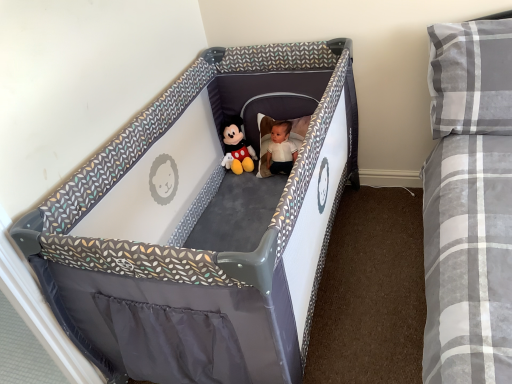
Where is `gray fabric playpen at center`? This screenshot has height=384, width=512. gray fabric playpen at center is located at coordinates (x=200, y=225).

Identify the location of gray plaid pillow at upper right. (471, 78).

The image size is (512, 384). I want to click on soft plush mickey mouse at center, so click(x=234, y=142).

The width and height of the screenshot is (512, 384). What do you see at coordinates (234, 142) in the screenshot?
I see `soft plush mickey mouse at center` at bounding box center [234, 142].

What are the coordinates of `gray fabric playpen at center` in the screenshot? It's located at (200, 225).

In the scene shown: In the image, is gray plaid pillow at upper right positioned in front of or behind gray fabric playpen at center?

gray plaid pillow at upper right is behind gray fabric playpen at center.

From the image's perspective, is gray plaid pillow at upper right positioned above or below gray fabric playpen at center?

From the image's perspective, gray plaid pillow at upper right appears above gray fabric playpen at center.

Is gray plaid pillow at upper right thinner than gray fabric playpen at center?

Correct, the width of gray plaid pillow at upper right is less than that of gray fabric playpen at center.

Would you consider gray plaid pillow at upper right to be distant from gray fabric playpen at center?

No, there isn't a large distance between gray plaid pillow at upper right and gray fabric playpen at center.

Based on the photo, from the image's perspective, between gray fabric playpen at center and soft plush mickey mouse at center, who is located below?

gray fabric playpen at center is shown below in the image.

From a real-world perspective, is gray fabric playpen at center positioned above or below soft plush mickey mouse at center?

In terms of real-world spatial position, gray fabric playpen at center is below soft plush mickey mouse at center.

Is gray fabric playpen at center in front of gray plaid pillow at upper right?

Yes, it is.

Between gray fabric playpen at center and gray plaid pillow at upper right, which one appears on the left side from the viewer's perspective?

gray fabric playpen at center.

Which of these two, gray fabric playpen at center or gray plaid pillow at upper right, is wider?

gray fabric playpen at center is wider.

In terms of size, does gray plaid pillow at upper right appear bigger or smaller than soft plush mickey mouse at center?

Clearly, gray plaid pillow at upper right is larger in size than soft plush mickey mouse at center.

Is gray plaid pillow at upper right in contact with soft plush mickey mouse at center?

No, gray plaid pillow at upper right is not beside soft plush mickey mouse at center.

Is soft plush mickey mouse at center completely or partially inside gray plaid pillow at upper right?

That's incorrect, soft plush mickey mouse at center is not inside gray plaid pillow at upper right.

Considering the relative positions of gray plaid pillow at upper right and soft plush mickey mouse at center in the image provided, is gray plaid pillow at upper right to the right of soft plush mickey mouse at center from the viewer's perspective?

Indeed, gray plaid pillow at upper right is positioned on the right side of soft plush mickey mouse at center.

Is soft plush mickey mouse at center facing towards gray plaid pillow at upper right?

No, soft plush mickey mouse at center is not aimed at gray plaid pillow at upper right.

Is soft plush mickey mouse at center next to gray plaid pillow at upper right?

There is a gap between soft plush mickey mouse at center and gray plaid pillow at upper right.

Does soft plush mickey mouse at center have a larger size compared to gray plaid pillow at upper right?

No, soft plush mickey mouse at center is not bigger than gray plaid pillow at upper right.

Which object is thinner, soft plush mickey mouse at center or gray plaid pillow at upper right?

soft plush mickey mouse at center is thinner.

Looking at their sizes, would you say soft plush mickey mouse at center is wider or thinner than gray fabric playpen at center?

Clearly, soft plush mickey mouse at center has less width compared to gray fabric playpen at center.

Is soft plush mickey mouse at center next to gray fabric playpen at center?

No, soft plush mickey mouse at center is not in contact with gray fabric playpen at center.

Considering the positions of objects soft plush mickey mouse at center and gray fabric playpen at center in the image provided, who is more to the left, soft plush mickey mouse at center or gray fabric playpen at center?

From the viewer's perspective, soft plush mickey mouse at center appears more on the left side.

The image size is (512, 384). I want to click on infant bed in front of the gray plaid pillow at upper right, so click(x=200, y=225).

This screenshot has height=384, width=512. In the image, there is a soft plush mickey mouse at center. What are the coordinates of `infant bed below it (from a real-world perspective)` in the screenshot? It's located at (200, 225).

When comparing their distances from gray fabric playpen at center, does gray plaid pillow at upper right or soft plush mickey mouse at center seem further?

gray plaid pillow at upper right.

Estimate the real-world distances between objects in this image. Which object is closer to soft plush mickey mouse at center, gray fabric playpen at center or gray plaid pillow at upper right?

Among the two, gray fabric playpen at center is located nearer to soft plush mickey mouse at center.

Estimate the real-world distances between objects in this image. Which object is further from gray plaid pillow at upper right, gray fabric playpen at center or soft plush mickey mouse at center?

soft plush mickey mouse at center.

Considering their positions, is soft plush mickey mouse at center positioned closer to gray fabric playpen at center than gray plaid pillow at upper right?

soft plush mickey mouse at center lies closer to gray fabric playpen at center than the other object.

Estimate the real-world distances between objects in this image. Which object is further from soft plush mickey mouse at center, gray plaid pillow at upper right or gray fabric playpen at center?

gray plaid pillow at upper right lies further to soft plush mickey mouse at center than the other object.

Based on their spatial positions, is soft plush mickey mouse at center or gray fabric playpen at center further from gray plaid pillow at upper right?

soft plush mickey mouse at center lies further to gray plaid pillow at upper right than the other object.

Locate an element on the screen. The height and width of the screenshot is (384, 512). pillow between gray fabric playpen at center and soft plush mickey mouse at center from front to back is located at coordinates (x=471, y=78).